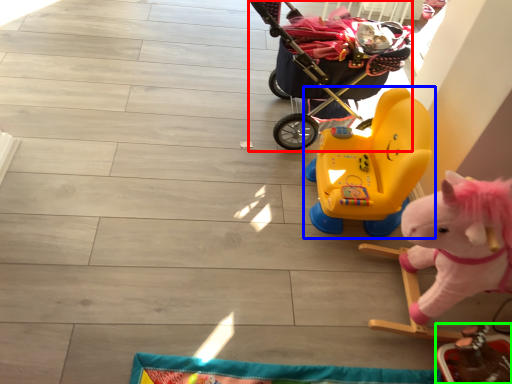
Question: Which object is positioned farthest from baby carriage (highlighted by a red box)? Select from toy (highlighted by a blue box) and toy (highlighted by a green box).

Choices:
 (A) toy
 (B) toy

Answer: (B)